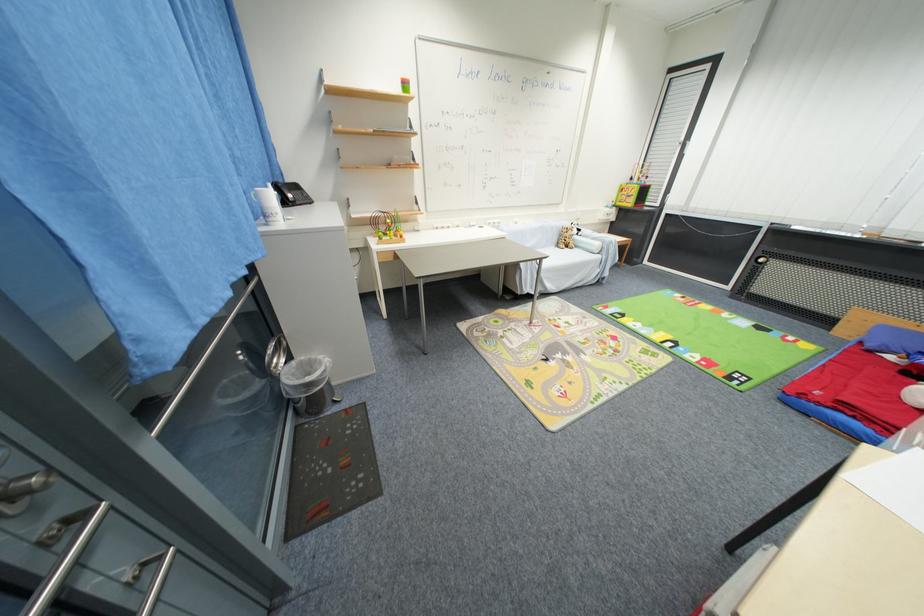
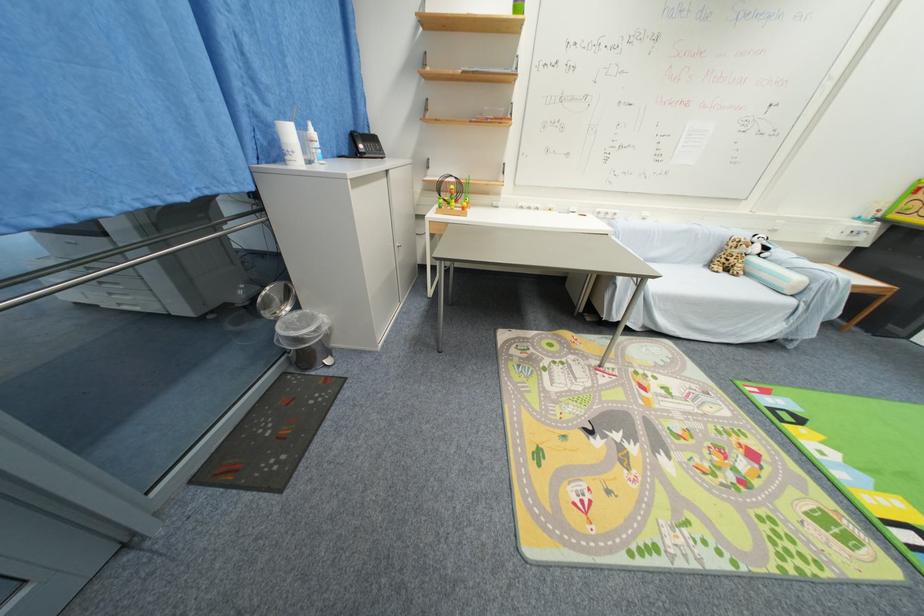
Question: The first image is from the beginning of the video and the second image is from the end. How did the camera likely rotate when shooting the video?

Choices:
 (A) Left
 (B) Right
 (C) Up
 (D) Down

Answer: (A)